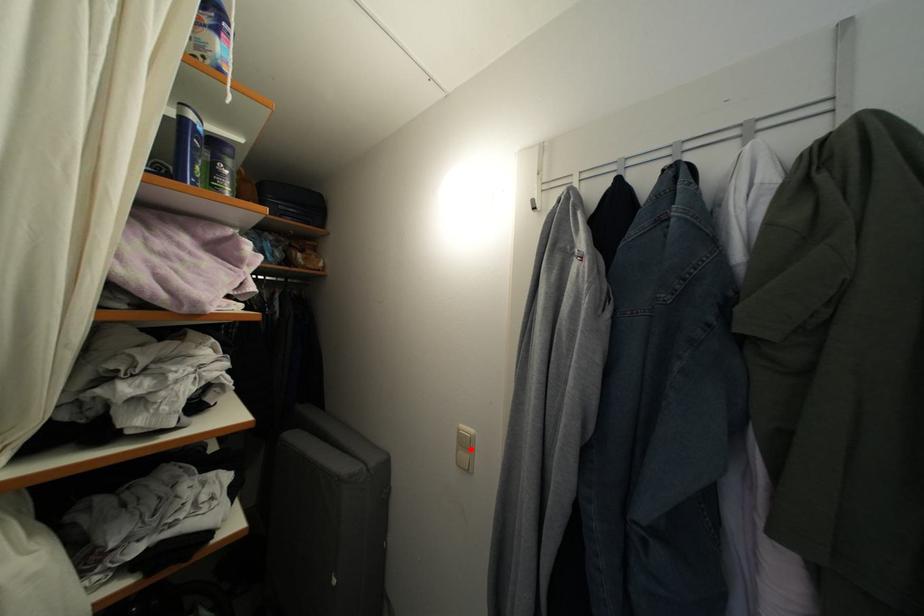
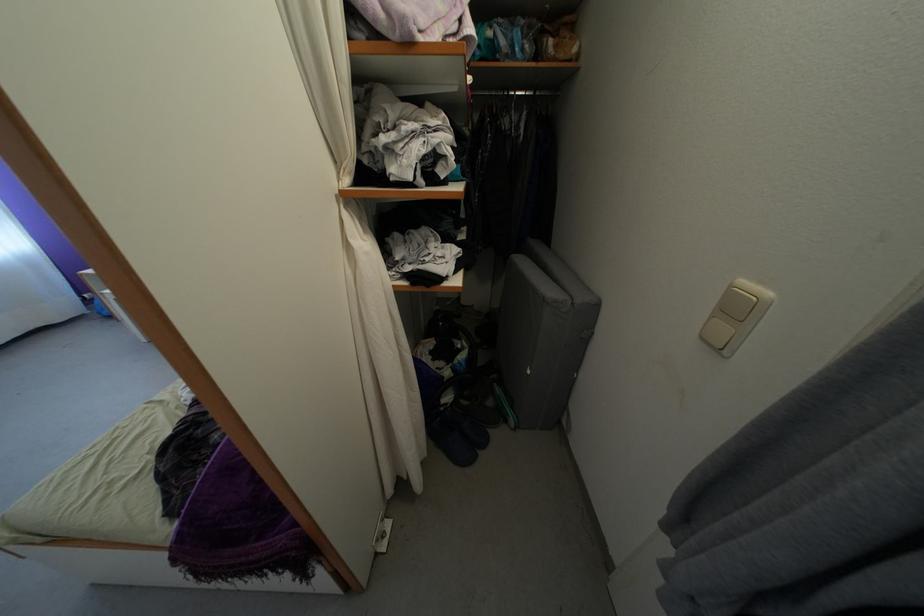
Locate, in the second image, the point that corresponds to the highlighted location in the first image.

(743, 315)